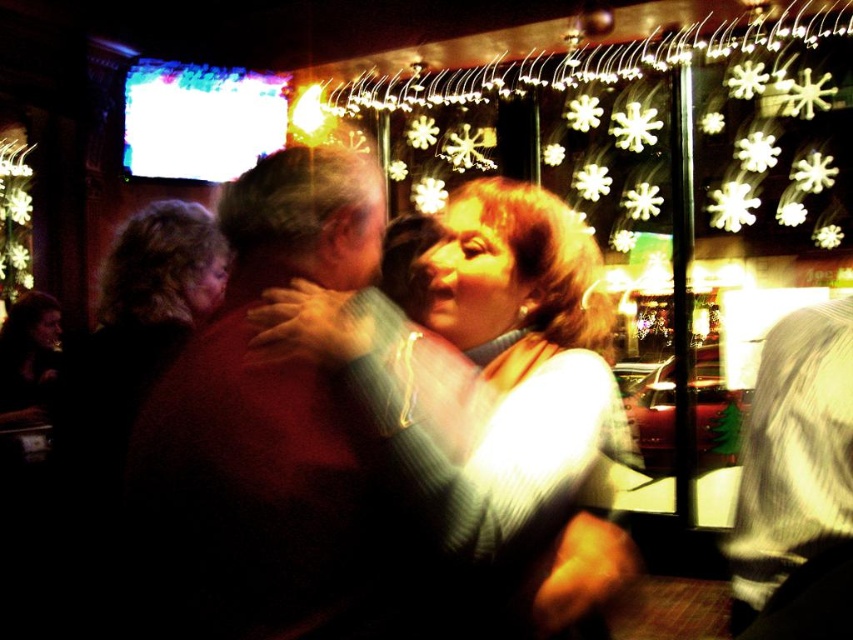
Measure the distance from illuminated plastic snowflake at upper center to smooth dark brown shirt at center.

illuminated plastic snowflake at upper center and smooth dark brown shirt at center are 3.55 meters apart from each other.

Describe the element at coordinates (628, 120) in the screenshot. The width and height of the screenshot is (853, 640). I see `illuminated plastic snowflake at upper center` at that location.

Find the location of a particular element. The width and height of the screenshot is (853, 640). illuminated plastic snowflake at upper center is located at coordinates (628, 120).

Is point (434, 337) farther from camera compared to point (752, 556)?

No, it is not.

Who is lower down, matte green sweater at center or smooth dark brown shirt at center?

smooth dark brown shirt at center

Is point (579, 580) positioned after point (796, 490)?

No.

Image resolution: width=853 pixels, height=640 pixels. What are the coordinates of `matte green sweater at center` in the screenshot? It's located at (479, 365).

How distant is illuminated plastic snowflake at upper center from matte green sweater at center?

illuminated plastic snowflake at upper center and matte green sweater at center are 11.83 feet apart.

Which is more to the right, illuminated plastic snowflake at upper center or matte green sweater at center?

Positioned to the right is illuminated plastic snowflake at upper center.

In order to click on illuminated plastic snowflake at upper center in this screenshot , I will do `click(628, 120)`.